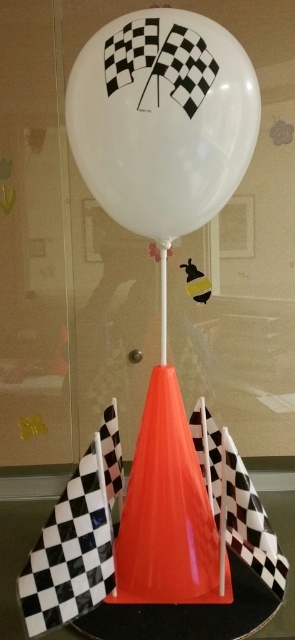
You are setting up a race track display and need to ensure the black checkered flag at lower left and the glossy plastic cone at center are visible from a distance. Which object might be more easily seen due to its size?

The black checkered flag at lower left is bigger than the glossy plastic cone at center, so it would be more easily seen from a distance due to its larger size.